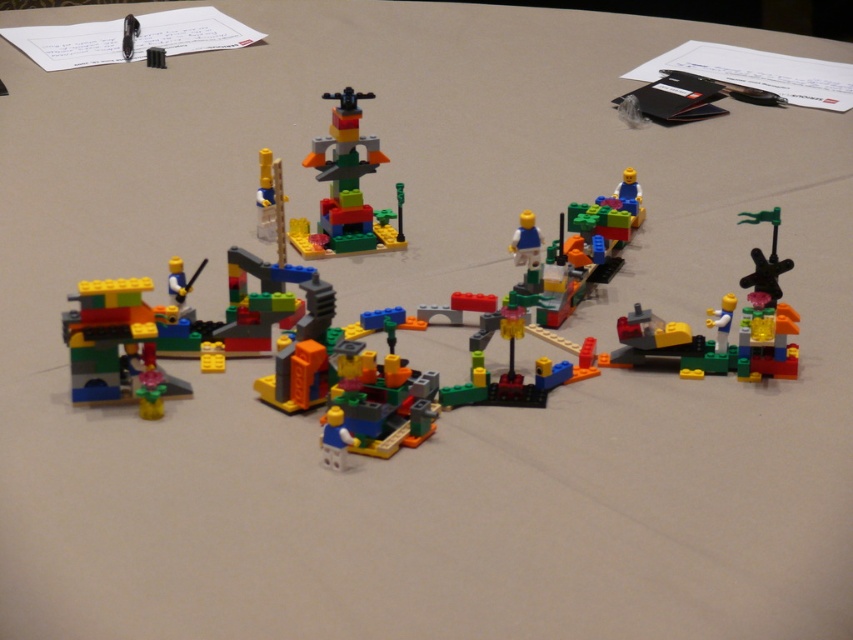
Does point (323, 172) lie behind point (759, 272)?

Yes, it is behind point (759, 272).

Measure the distance between multicolored plastic tower at center and translucent green plastic spinner at right.

multicolored plastic tower at center and translucent green plastic spinner at right are 13.27 inches apart.

Image resolution: width=853 pixels, height=640 pixels. Describe the element at coordinates (344, 186) in the screenshot. I see `multicolored plastic tower at center` at that location.

Locate an element on the screen. The width and height of the screenshot is (853, 640). multicolored plastic tower at center is located at coordinates (344, 186).